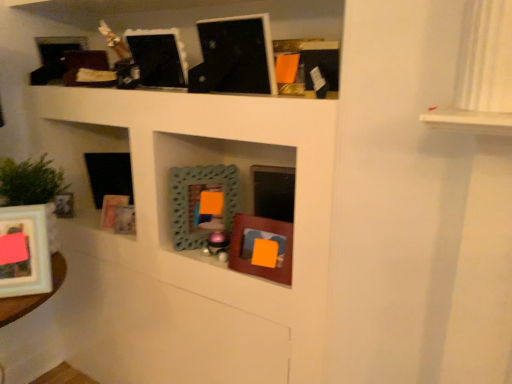
Question: From a real-world perspective, is teal textured mirror at center, acting as the 7th picture frame starting from the left, located beneath matte white picture frame at lower left, which appears as the 8th picture frame when viewed from the right?

Choices:
 (A) yes
 (B) no

Answer: (B)

Question: Is teal textured mirror at center, acting as the 7th picture frame starting from the left, at the left side of matte white picture frame at lower left, arranged as the 2th picture frame when viewed from the left?

Choices:
 (A) no
 (B) yes

Answer: (A)

Question: Is teal textured mirror at center, which is the 3th picture frame from right to left, thinner than matte white picture frame at lower left, arranged as the 2th picture frame when viewed from the left?

Choices:
 (A) yes
 (B) no

Answer: (A)

Question: Can you confirm if teal textured mirror at center, which is the 3th picture frame from right to left, is smaller than matte white picture frame at lower left, arranged as the 2th picture frame when viewed from the left?

Choices:
 (A) yes
 (B) no

Answer: (A)

Question: From the image's perspective, is teal textured mirror at center, acting as the 7th picture frame starting from the left, under matte white picture frame at lower left, which appears as the 8th picture frame when viewed from the right?

Choices:
 (A) no
 (B) yes

Answer: (A)

Question: Is teal textured mirror at center, which is the 3th picture frame from right to left, positioned far away from matte white picture frame at lower left, which appears as the 8th picture frame when viewed from the right?

Choices:
 (A) yes
 (B) no

Answer: (B)

Question: Is matte white picture frame at lower left, arranged as the 2th picture frame when viewed from the left, at the back of wooden picture frame at lower left, placed as the 5th picture frame when sorted from right to left?

Choices:
 (A) no
 (B) yes

Answer: (A)

Question: From the image's perspective, would you say wooden picture frame at lower left, placed as the 5th picture frame when sorted from right to left, is positioned over matte white picture frame at lower left, arranged as the 2th picture frame when viewed from the left?

Choices:
 (A) no
 (B) yes

Answer: (B)

Question: Considering the relative positions of wooden picture frame at lower left, placed as the 5th picture frame when sorted from right to left, and matte white picture frame at lower left, which appears as the 8th picture frame when viewed from the right, in the image provided, is wooden picture frame at lower left, placed as the 5th picture frame when sorted from right to left, to the right of matte white picture frame at lower left, which appears as the 8th picture frame when viewed from the right, from the viewer's perspective?

Choices:
 (A) no
 (B) yes

Answer: (B)

Question: Can you see wooden picture frame at lower left, placed as the 5th picture frame when sorted from right to left, touching matte white picture frame at lower left, which appears as the 8th picture frame when viewed from the right?

Choices:
 (A) no
 (B) yes

Answer: (A)

Question: From a real-world perspective, is wooden picture frame at lower left, placed as the 5th picture frame when sorted from right to left, physically below matte white picture frame at lower left, arranged as the 2th picture frame when viewed from the left?

Choices:
 (A) no
 (B) yes

Answer: (B)

Question: From a real-world perspective, does wooden picture frame at lower left, arranged as the 5th picture frame when viewed from the left, stand above matte white picture frame at lower left, arranged as the 2th picture frame when viewed from the left?

Choices:
 (A) yes
 (B) no

Answer: (B)

Question: Does matte white picture frame at lower left, arranged as the 2th picture frame when viewed from the left, have a greater height compared to wooden picture frame at lower left, placed as the 5th picture frame when sorted from right to left?

Choices:
 (A) no
 (B) yes

Answer: (B)